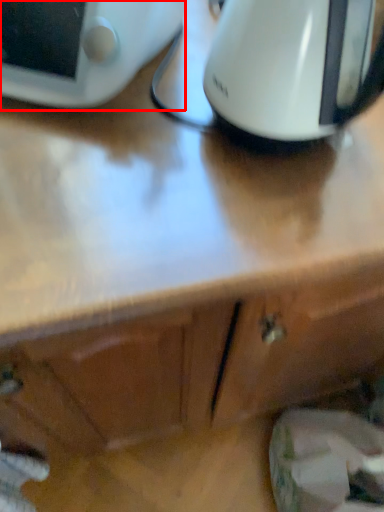
Question: From the image's perspective, where is home appliance (annotated by the red box) located relative to kitchen appliance?

Choices:
 (A) below
 (B) above

Answer: (B)